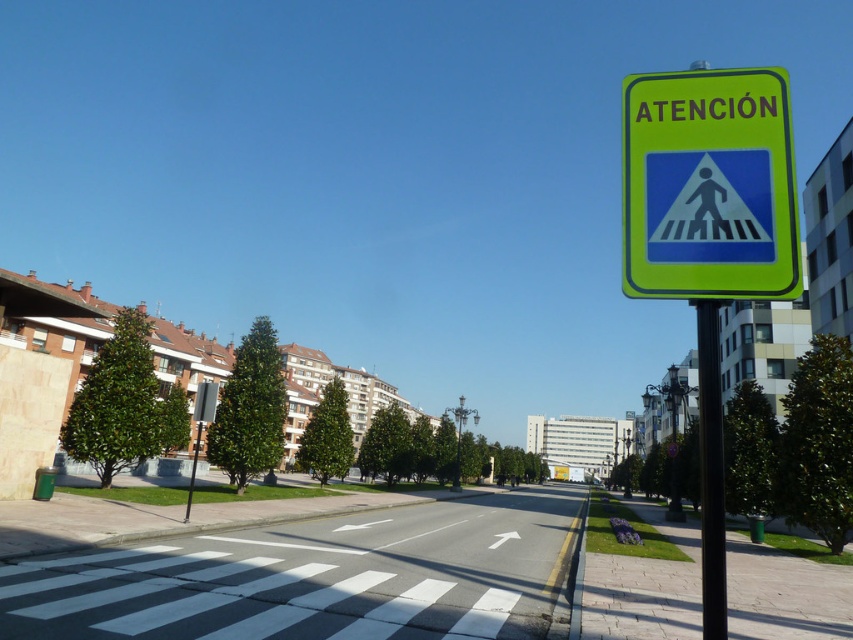
Looking at this image, you are standing at the center of the pedestrian crossing and want to locate the metallic pole at right. According to the scene description, where would you find it relative to your position?

The metallic pole at right is located at point [711,472], which is to the right and slightly ahead of your position at the center of the pedestrian crossing.